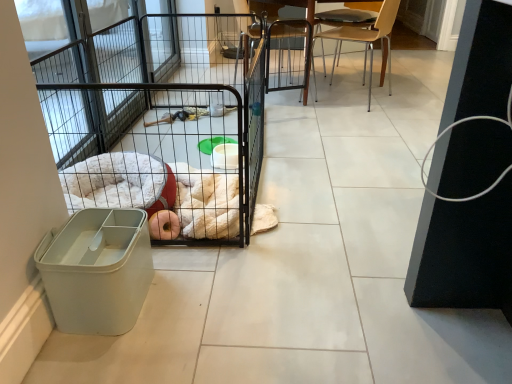
Question: Would you say light brown wooden chair at upper right, which appears as the second chair when viewed from the left, is to the left or to the right of wooden chair at center, which appears as the first chair when viewed from the left, in the picture?

Choices:
 (A) left
 (B) right

Answer: (B)

Question: Does point (393, 23) appear closer or farther from the camera than point (301, 38)?

Choices:
 (A) closer
 (B) farther

Answer: (B)

Question: Which is nearer to the black wire cage at center?

Choices:
 (A) light brown wooden chair at upper right, which appears as the second chair when viewed from the left
 (B) wooden chair at center, which appears as the first chair when viewed from the left

Answer: (B)

Question: Which object is positioned farthest from the wooden chair at center, which appears as the first chair when viewed from the left?

Choices:
 (A) black wire cage at center
 (B) light brown wooden chair at upper right, which appears as the second chair when viewed from the left

Answer: (A)